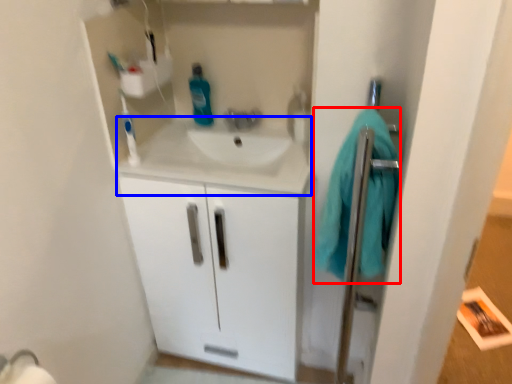
Question: Which of the following is the closest to the observer, bath towel (highlighted by a red box) or counter top (highlighted by a blue box)?

Choices:
 (A) bath towel
 (B) counter top

Answer: (A)